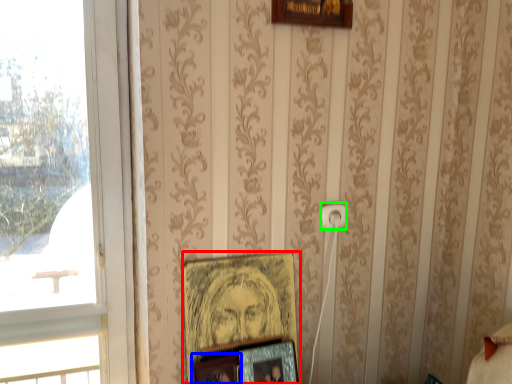
Question: Which object is the farthest from picture frame (highlighted by a red box)? Choose among these: picture frame (highlighted by a blue box) or electric outlet (highlighted by a green box).

Choices:
 (A) picture frame
 (B) electric outlet

Answer: (B)